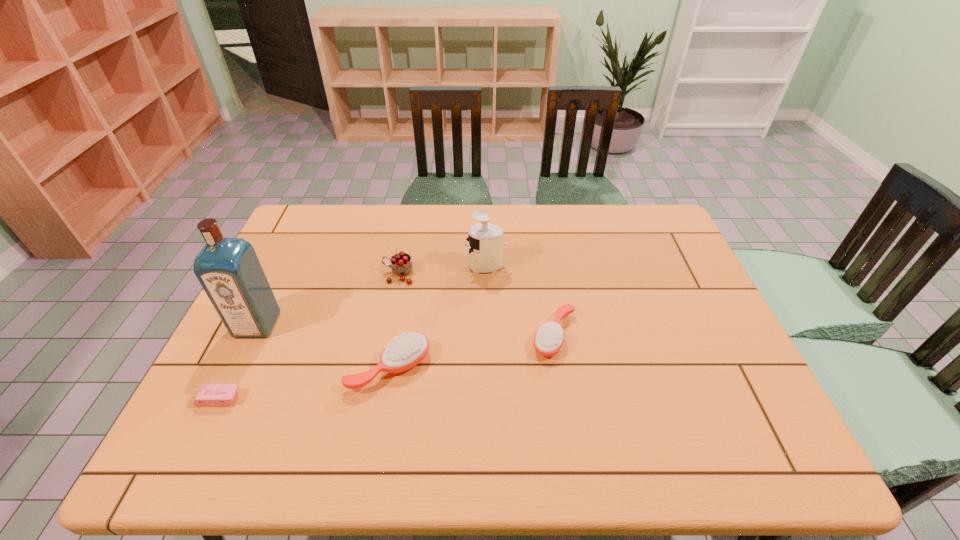
This screenshot has width=960, height=540. I want to click on vacant point located between the taller hairbrush and the liquor, so click(x=324, y=346).

You are a GUI agent. You are given a task and a screenshot of the screen. Output one action in this format:
    pyautogui.click(x=<x>, y=<y>)
    Task: Click on the vacant point located between the second shortest object and the juicer
    
    Given the screenshot: What is the action you would take?
    (520, 301)

What are the coordinates of `free space that is in between the fifth object from left to right and the right hairbrush` in the screenshot? It's located at (520, 301).

I want to click on vacant point located between the fourth tallest object and the tallest object, so click(324, 346).

Where is `free space between the left hairbrush and the shortest object`? free space between the left hairbrush and the shortest object is located at coordinates (304, 383).

Find the location of a particular element. Image resolution: width=960 pixels, height=540 pixels. unoccupied position between the third tallest object and the shortest object is located at coordinates (309, 336).

Identify the location of vacant space in between the shorter hairbrush and the third tallest object. The width and height of the screenshot is (960, 540). (476, 305).

Identify the location of the second closest object to the rightmost object. (406, 351).

You are a GUI agent. You are given a task and a screenshot of the screen. Output one action in this format:
    pyautogui.click(x=<x>, y=<y>)
    Task: Click on the second closest object to the right hairbrush
    This screenshot has width=960, height=540.
    Given the screenshot: What is the action you would take?
    pos(406,351)

You are a GUI agent. You are given a task and a screenshot of the screen. Output one action in this format:
    pyautogui.click(x=<x>, y=<y>)
    Task: Click on the free spot that satisfies the following two spatial constraints: 1. on the flat label side of the second shortest object; 2. on the left side of the tallest object
    The image size is (960, 540).
    Given the screenshot: What is the action you would take?
    pyautogui.click(x=252, y=336)